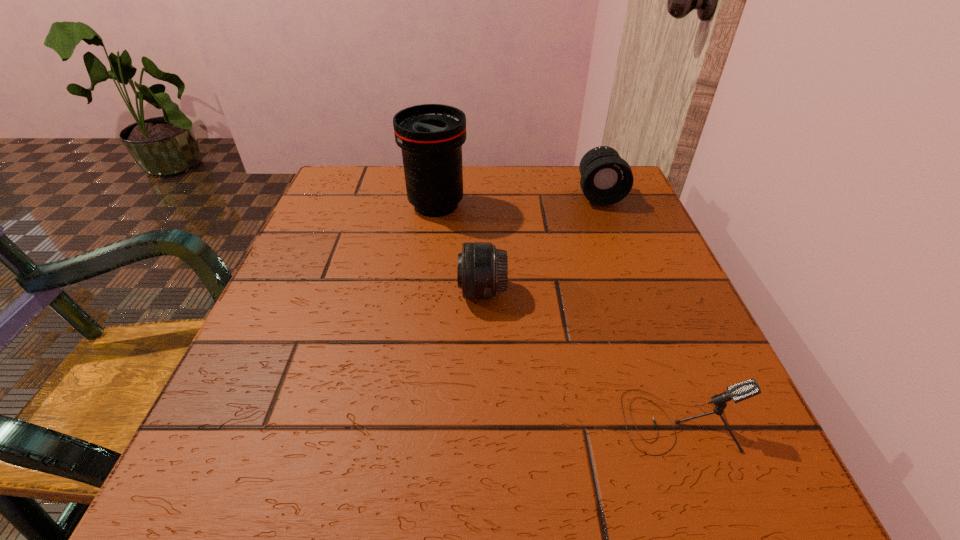
What are the coordinates of `free region at the right edge` in the screenshot? It's located at (625, 377).

The height and width of the screenshot is (540, 960). In order to click on free space at the far left corner of the desktop in this screenshot , I will do 344,207.

In the image, there is a desktop. Where is `vacant region at the near left corner`? The image size is (960, 540). vacant region at the near left corner is located at coordinates (210, 495).

You are a GUI agent. You are given a task and a screenshot of the screen. Output one action in this format:
    pyautogui.click(x=<x>, y=<y>)
    Task: Click on the vacant region at the far right corner
    This screenshot has height=540, width=960.
    Given the screenshot: What is the action you would take?
    click(578, 188)

Locate an element on the screen. vacant space at the near right corner is located at coordinates (675, 480).

What are the coordinates of `vacant region between the tallest object and the rightmost telephoto lens` in the screenshot? It's located at (517, 200).

In order to click on free spot between the nearest object and the tallest telephoto lens in this screenshot , I will do `click(558, 313)`.

You are a GUI agent. You are given a task and a screenshot of the screen. Output one action in this format:
    pyautogui.click(x=<x>, y=<y>)
    Task: Click on the vacant space in between the tallest telephoto lens and the rightmost telephoto lens
    The width and height of the screenshot is (960, 540).
    Given the screenshot: What is the action you would take?
    pyautogui.click(x=517, y=200)

You are a GUI agent. You are given a task and a screenshot of the screen. Output one action in this format:
    pyautogui.click(x=<x>, y=<y>)
    Task: Click on the free space between the nearest telephoto lens and the nearest object
    This screenshot has width=960, height=540.
    Given the screenshot: What is the action you would take?
    pyautogui.click(x=581, y=356)

Identify the location of free space between the rightmost telephoto lens and the tallest object. This screenshot has height=540, width=960. (517, 200).